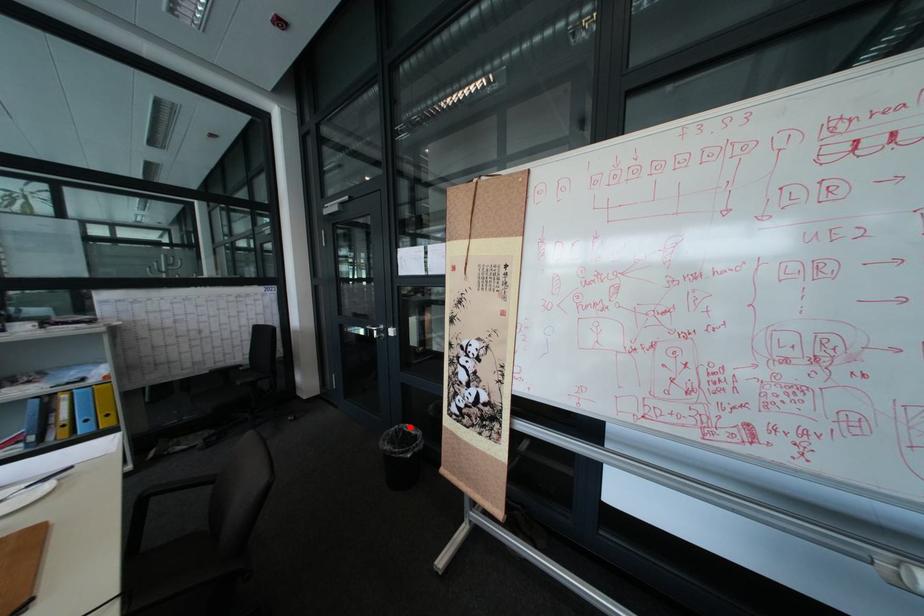
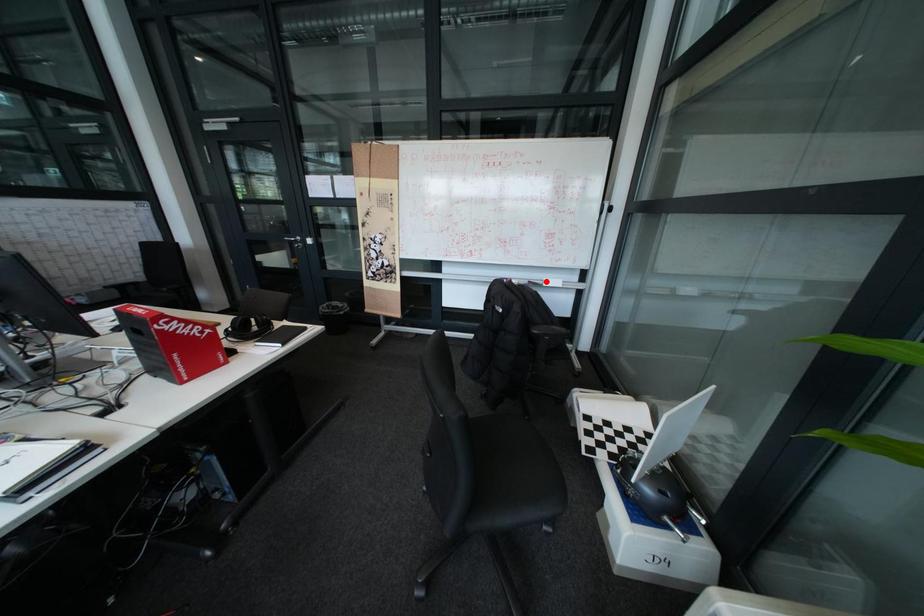
I am providing you with two images of the same scene from different viewpoints. A red point is marked on the first image and another point is marked on the second image. Do the highlighted points in image1 and image2 indicate the same real-world spot?

No